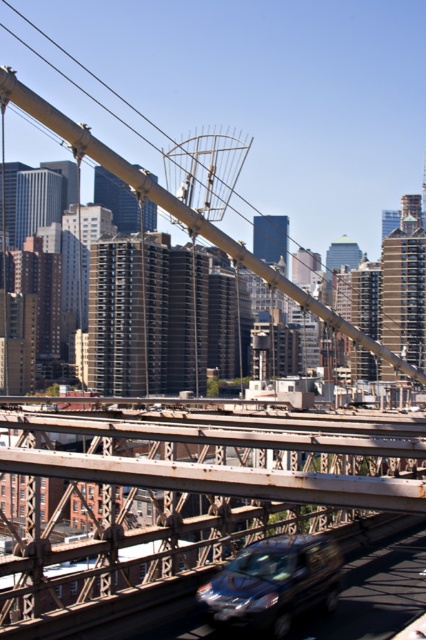
Which is more to the left, rusty metal bridge at center or metallic silver van at center?

From the viewer's perspective, rusty metal bridge at center appears more on the left side.

Does rusty metal bridge at center have a smaller size compared to metallic silver van at center?

Incorrect, rusty metal bridge at center is not smaller in size than metallic silver van at center.

Image resolution: width=426 pixels, height=640 pixels. Describe the element at coordinates (187, 500) in the screenshot. I see `rusty metal bridge at center` at that location.

This screenshot has height=640, width=426. Find the location of `rusty metal bridge at center`. rusty metal bridge at center is located at coordinates point(187,500).